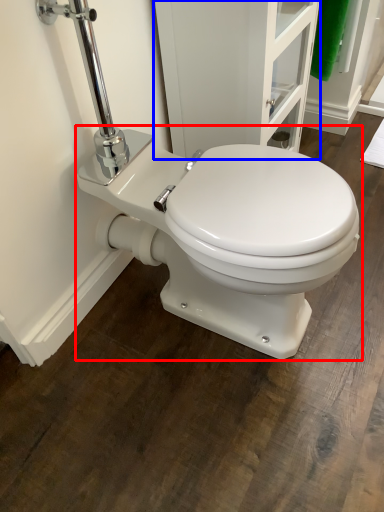
Question: Which object is closer to the camera taking this photo, toilet (highlighted by a red box) or screen door (highlighted by a blue box)?

Choices:
 (A) toilet
 (B) screen door

Answer: (A)